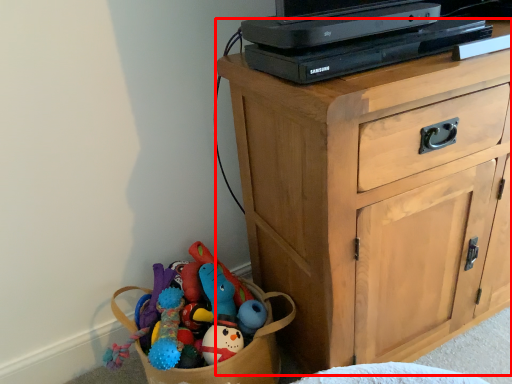
Question: Where is chest of drawers (annotated by the red box) located in relation to computer in the image?

Choices:
 (A) left
 (B) right

Answer: (B)